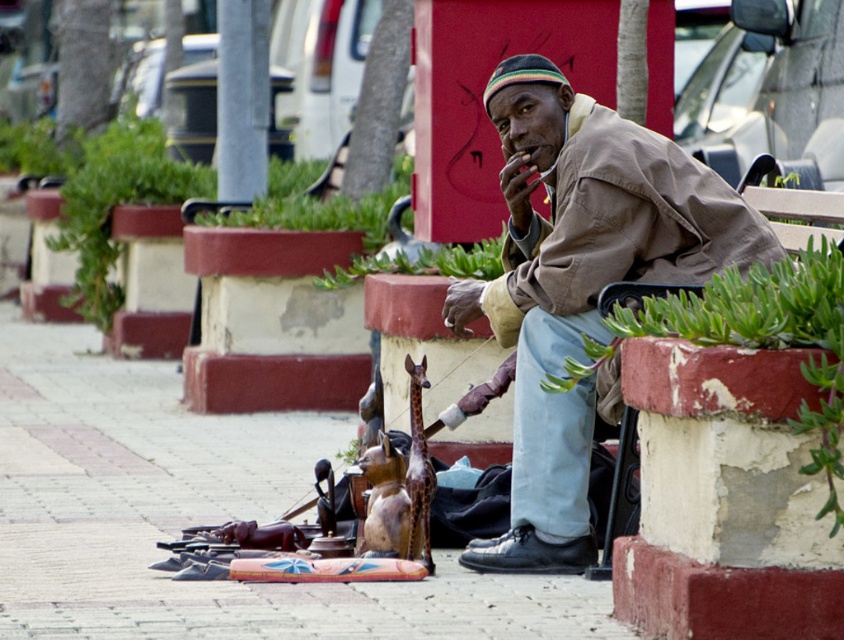
Question: From the image, what is the correct spatial relationship of wooden figurines at lower center in relation to brown cotton jacket at center?

Choices:
 (A) above
 (B) below

Answer: (B)

Question: Can you confirm if brown cotton jacket at center is bigger than black leather shoe at lower center?

Choices:
 (A) no
 (B) yes

Answer: (B)

Question: Which of these objects is positioned closest to the brown cotton jacket at center?

Choices:
 (A) black leather shoe at lower center
 (B) wooden figurines at lower center

Answer: (A)

Question: Does wooden figurines at lower center have a smaller size compared to black leather shoe at lower center?

Choices:
 (A) no
 (B) yes

Answer: (A)

Question: Which point is farther to the camera?

Choices:
 (A) (517, 538)
 (B) (598, 381)
 (C) (448, 577)

Answer: (A)

Question: Which point is farther to the camera?

Choices:
 (A) brown cotton jacket at center
 (B) wooden figurines at lower center

Answer: (A)